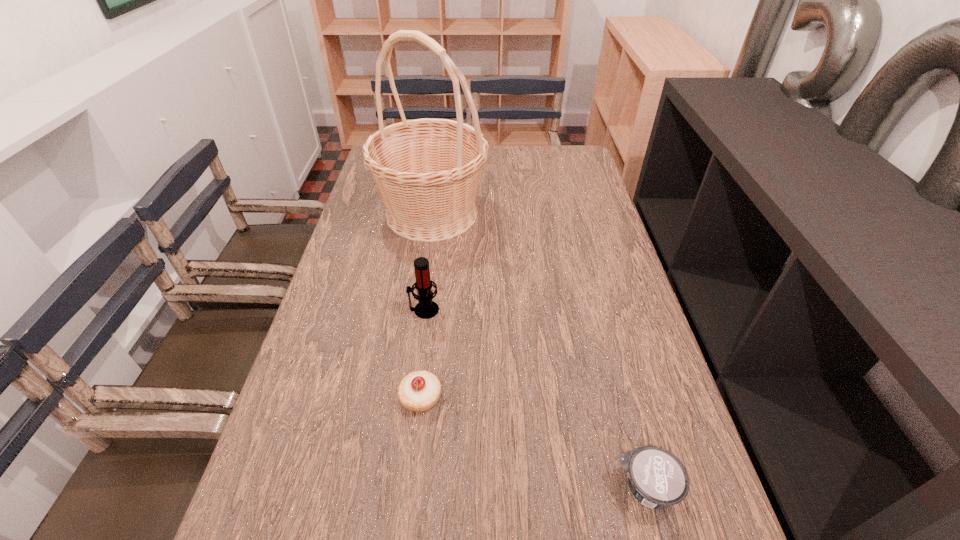
At what (x,y) coordinates should I click in order to perform the action: click on the tallest object. Please return your answer as a coordinate pair (x, y). Image resolution: width=960 pixels, height=540 pixels. Looking at the image, I should click on 427,171.

Where is `basket`? basket is located at coordinates (427, 171).

Find the location of a particular element. This screenshot has height=540, width=960. the second farthest object is located at coordinates (426, 308).

At what (x,y) coordinates should I click in order to perform the action: click on microphone. Please return your answer as a coordinate pair (x, y). The height and width of the screenshot is (540, 960). Looking at the image, I should click on (426, 308).

The image size is (960, 540). Identify the location of the second nearest object. (419, 391).

Identify the location of the nearest object. (657, 478).

Identify the location of yogurt. (657, 478).

Locate an element on the screen. Image resolution: width=960 pixels, height=540 pixels. free space located 0.300m on the back of the tallest object is located at coordinates (442, 144).

This screenshot has width=960, height=540. I want to click on free spot located on the right of the third shortest object, so click(x=534, y=310).

Locate an element on the screen. Image resolution: width=960 pixels, height=540 pixels. vacant space situated 0.230m on the back of the third farthest object is located at coordinates tap(431, 303).